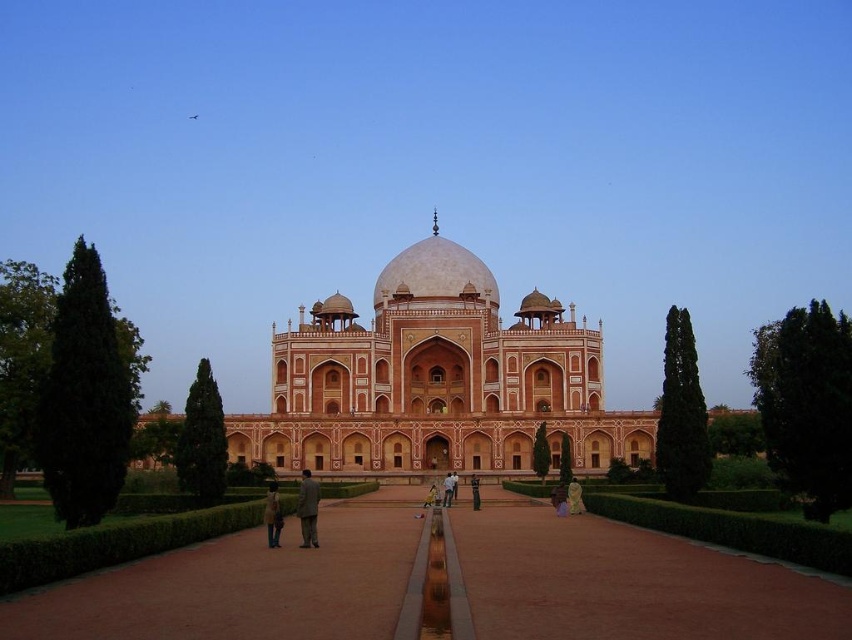
Question: Which point is farther to the camera?

Choices:
 (A) light brown fabric pants at center
 (B) matte orange-red stone palace at center
 (C) light brown fabric coat at center

Answer: (A)

Question: Is dark gray suit at center to the right of light brown fabric coat at center from the viewer's perspective?

Choices:
 (A) no
 (B) yes

Answer: (B)

Question: Is the position of light green fabric at center less distant than that of light brown fabric pants at center?

Choices:
 (A) yes
 (B) no

Answer: (A)

Question: Does matte orange-red stone palace at center have a smaller size compared to light brown fabric pants at center?

Choices:
 (A) yes
 (B) no

Answer: (B)

Question: Among these objects, which one is farthest from the camera?

Choices:
 (A) light green fabric at center
 (B) light brown fabric pants at center
 (C) light brown fabric coat at center

Answer: (B)

Question: Which object is positioned farthest from the dark gray suit at center?

Choices:
 (A) matte orange-red stone palace at center
 (B) light green fabric at center
 (C) light brown fabric pants at center
 (D) light brown fabric coat at center

Answer: (B)